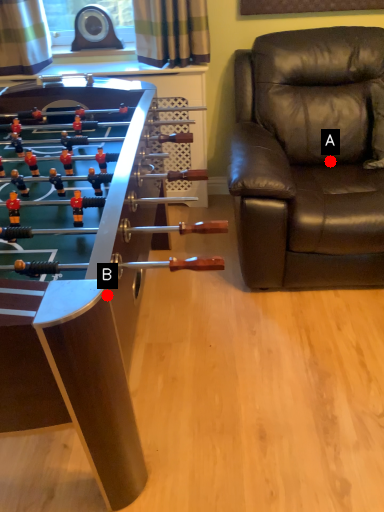
Question: Two points are circled on the image, labeled by A and B beside each circle. Among these points, which one is nearest to the camera?

Choices:
 (A) A is closer
 (B) B is closer

Answer: (B)